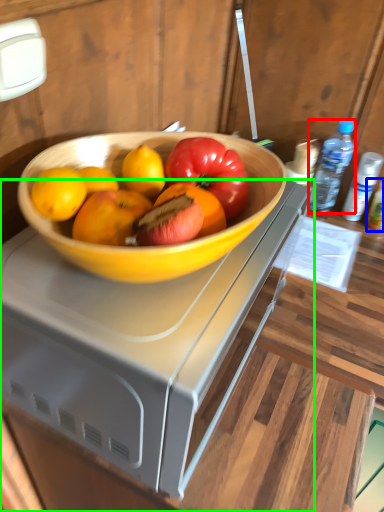
Question: Which is farther away from bottle (highlighted by a red box)? bottle (highlighted by a blue box) or desk (highlighted by a green box)?

Choices:
 (A) bottle
 (B) desk

Answer: (B)